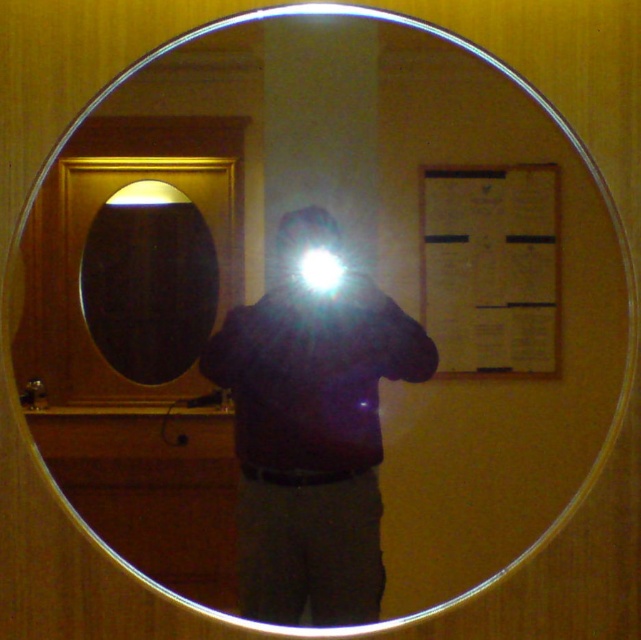
Question: Is dark matte jacket at center behind matte black oval mirror at left?

Choices:
 (A) yes
 (B) no

Answer: (B)

Question: Can you confirm if dark matte jacket at center is positioned to the left of matte black oval mirror at left?

Choices:
 (A) no
 (B) yes

Answer: (A)

Question: Can you confirm if dark matte jacket at center is wider than matte black oval mirror at left?

Choices:
 (A) no
 (B) yes

Answer: (B)

Question: Which of the following is the closest to the observer?

Choices:
 (A) matte black oval mirror at left
 (B) dark matte jacket at center

Answer: (B)